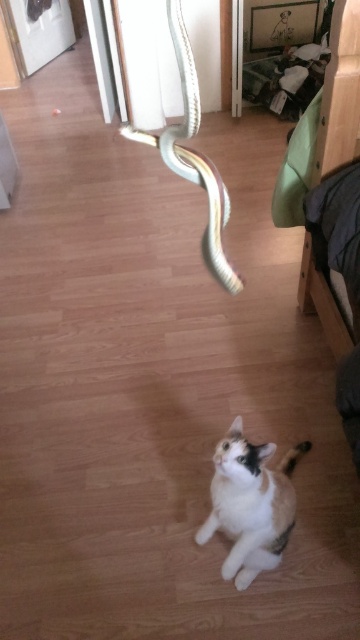
Question: Which point appears closest to the camera in this image?

Choices:
 (A) coord(286,468)
 (B) coord(176,29)

Answer: (B)

Question: Observing the image, what is the correct spatial positioning of calico fur cat at center in reference to white glossy tail at lower center?

Choices:
 (A) above
 (B) below

Answer: (A)

Question: Which object appears farthest from the camera in this image?

Choices:
 (A) shiny metallic snake at upper center
 (B) calico fur cat at center

Answer: (B)

Question: Can you confirm if calico fur cat at center is positioned above white glossy tail at lower center?

Choices:
 (A) yes
 (B) no

Answer: (A)

Question: Among these points, which one is farthest from the camera?

Choices:
 (A) (200, 163)
 (B) (288, 480)
 (C) (286, 454)

Answer: (C)

Question: Can you confirm if calico fur cat at center is wider than white glossy tail at lower center?

Choices:
 (A) no
 (B) yes

Answer: (B)